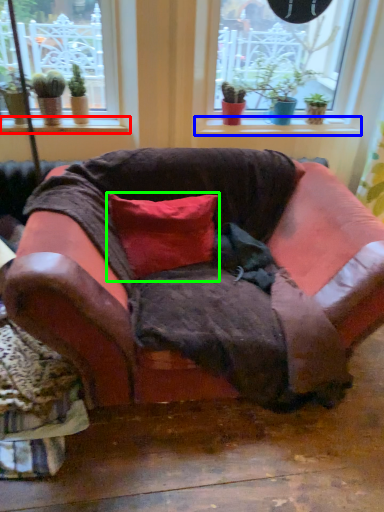
Question: Which is farther away from window sill (highlighted by a red box)? window sill (highlighted by a blue box) or pillow (highlighted by a green box)?

Choices:
 (A) window sill
 (B) pillow

Answer: (A)